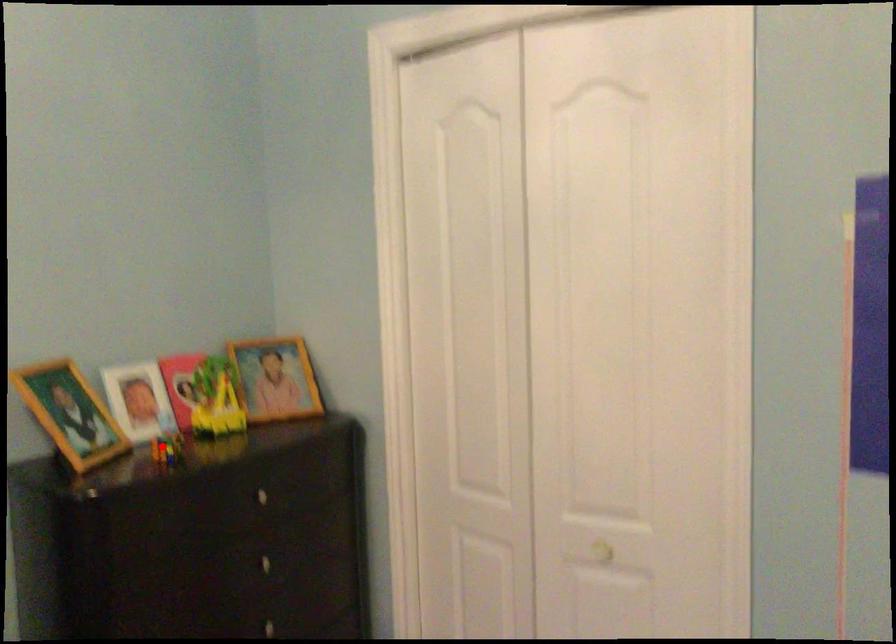
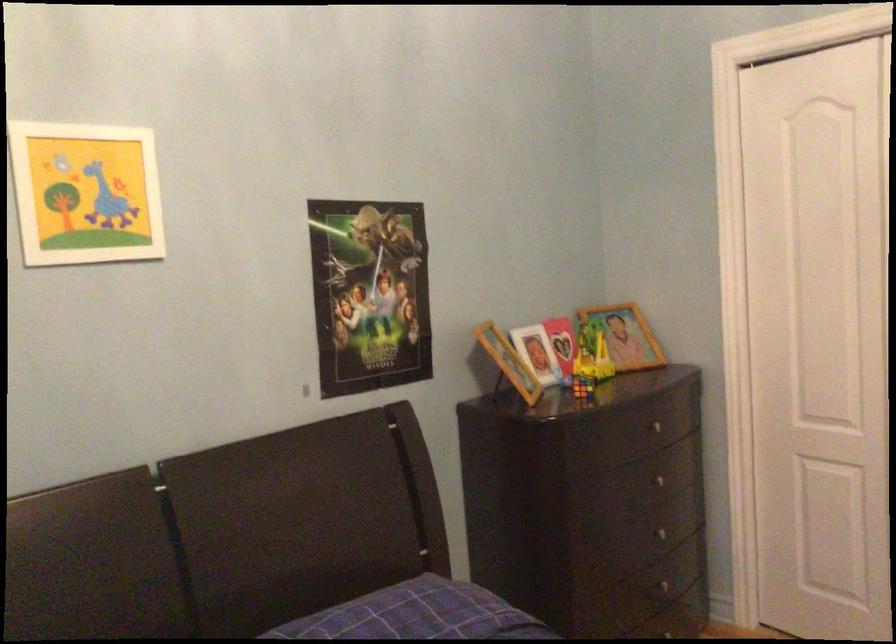
Where in the second image is the point corresponding to the highlighted location from the first image?

(582, 386)